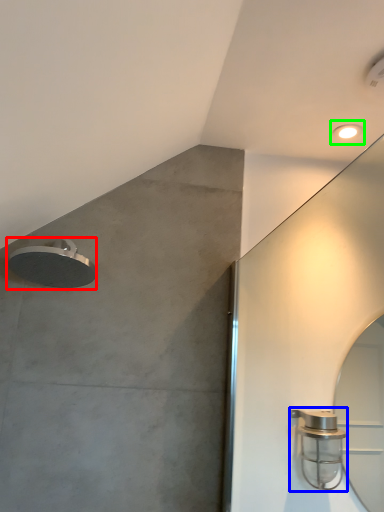
Question: Considering the real-world distances, which object is farthest from shower (highlighted by a red box)? shower (highlighted by a blue box) or droplight (highlighted by a green box)?

Choices:
 (A) shower
 (B) droplight

Answer: (B)